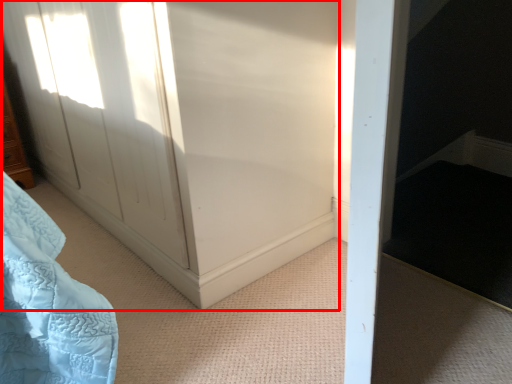
Question: Considering the relative positions of screen door (annotated by the red box) and furniture in the image provided, where is screen door (annotated by the red box) located with respect to the staircase?

Choices:
 (A) left
 (B) right

Answer: (B)